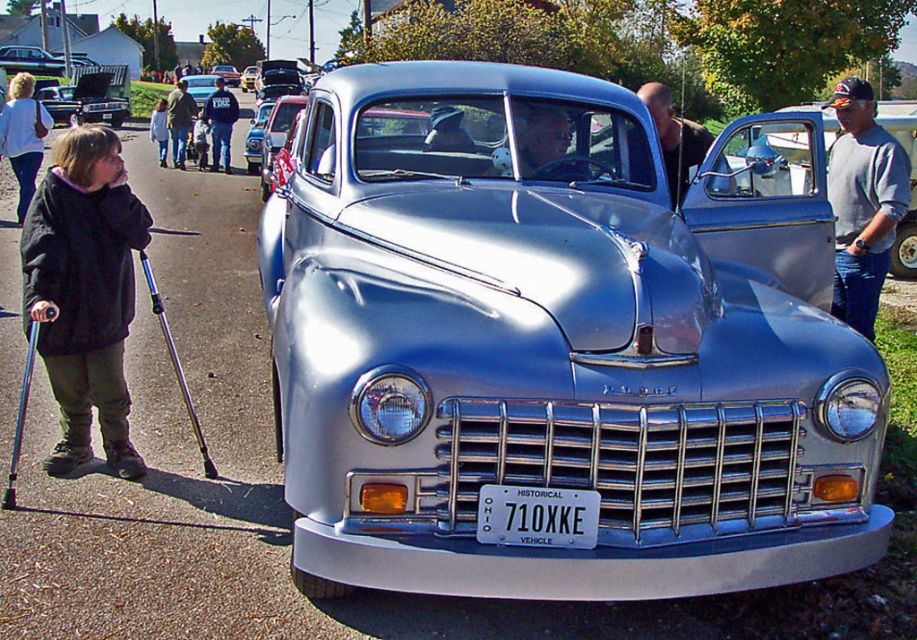
Can you confirm if gray sweater at right is shorter than smooth silver car at center?

Indeed, gray sweater at right has a lesser height compared to smooth silver car at center.

Who is more forward, (x=882, y=216) or (x=682, y=144)?

Point (x=882, y=216) is more forward.

In order to click on gray sweater at right in this screenshot , I will do `click(862, 202)`.

The height and width of the screenshot is (640, 917). Identify the location of dark blue jeans at center. (219, 124).

Between dark blue jeans at center and light blue denim jacket at upper center, which one has more height?

With more height is light blue denim jacket at upper center.

Does point (221, 161) lie behind point (160, 156)?

No, (221, 161) is closer to viewer.

Find the location of a particular element. dark blue jeans at center is located at coordinates (219, 124).

Describe the element at coordinates (862, 202) in the screenshot. I see `gray sweater at right` at that location.

Does gray sweater at right have a lesser height compared to dark blue jeans at center?

Indeed, gray sweater at right has a lesser height compared to dark blue jeans at center.

Identify the location of gray sweater at right. The image size is (917, 640). (862, 202).